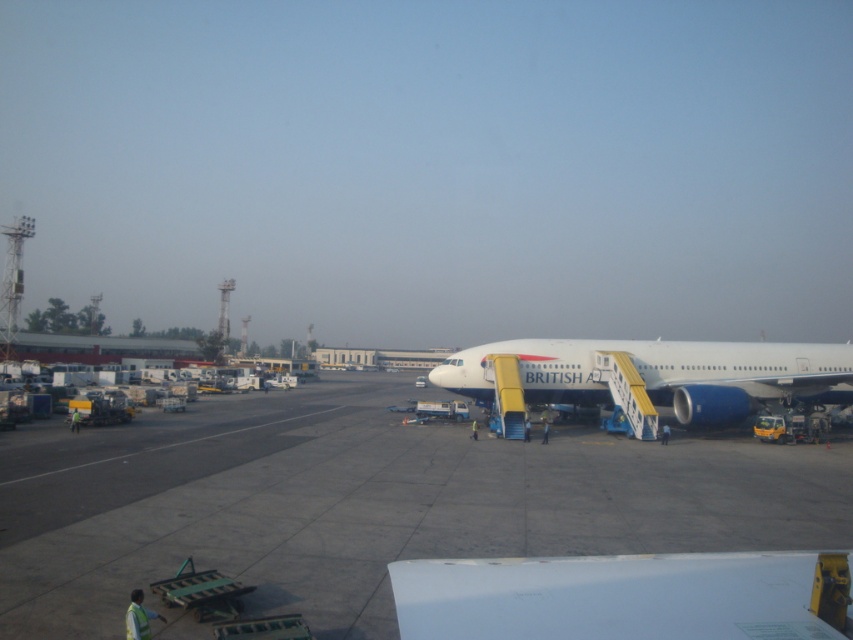
Question: Can you confirm if gray concrete tarmac at center is wider than white matte airplane at center?

Choices:
 (A) yes
 (B) no

Answer: (A)

Question: Considering the relative positions of gray concrete tarmac at center and white matte airplane at center in the image provided, where is gray concrete tarmac at center located with respect to white matte airplane at center?

Choices:
 (A) left
 (B) right

Answer: (A)

Question: Is gray concrete tarmac at center to the right of white matte airplane at center from the viewer's perspective?

Choices:
 (A) yes
 (B) no

Answer: (B)

Question: Among these objects, which one is nearest to the camera?

Choices:
 (A) white matte airplane at center
 (B) gray concrete tarmac at center

Answer: (B)

Question: Which point is farther to the camera?

Choices:
 (A) (602, 397)
 (B) (93, 554)

Answer: (A)